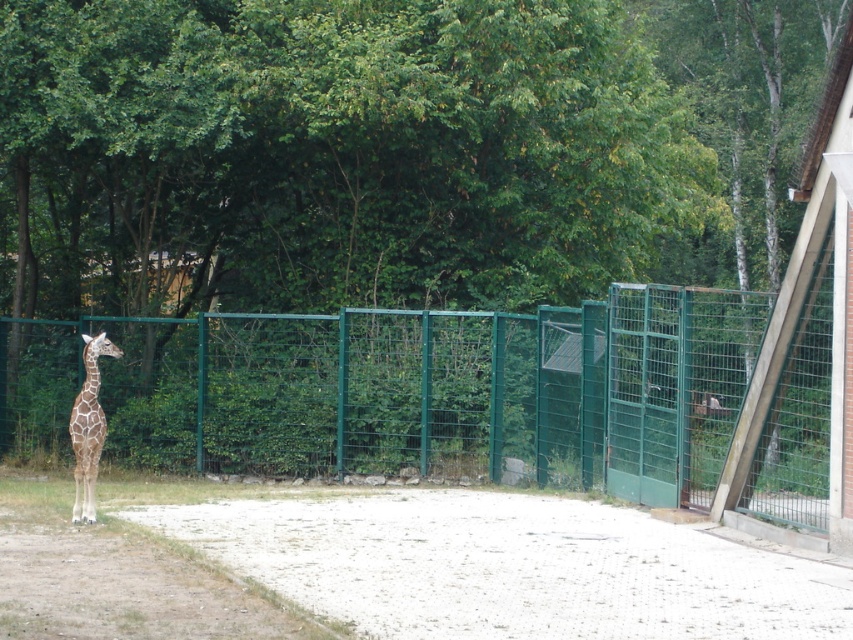
Question: Is green wire mesh fence at left further to the viewer compared to spotted fur giraffe at left?

Choices:
 (A) yes
 (B) no

Answer: (B)

Question: Which object is closer to the camera taking this photo?

Choices:
 (A) green wire mesh fence at left
 (B) white gravel at center

Answer: (B)

Question: Among these objects, which one is nearest to the camera?

Choices:
 (A) green wire mesh fence at left
 (B) white gravel at center
 (C) spotted fur giraffe at left

Answer: (B)

Question: Does green wire mesh fence at left have a greater width compared to white gravel at center?

Choices:
 (A) yes
 (B) no

Answer: (A)

Question: Can you confirm if green wire mesh fence at left is thinner than spotted fur giraffe at left?

Choices:
 (A) yes
 (B) no

Answer: (B)

Question: Based on their relative distances, which object is nearer to the spotted fur giraffe at left?

Choices:
 (A) green wire mesh fence at left
 (B) white gravel at center

Answer: (B)